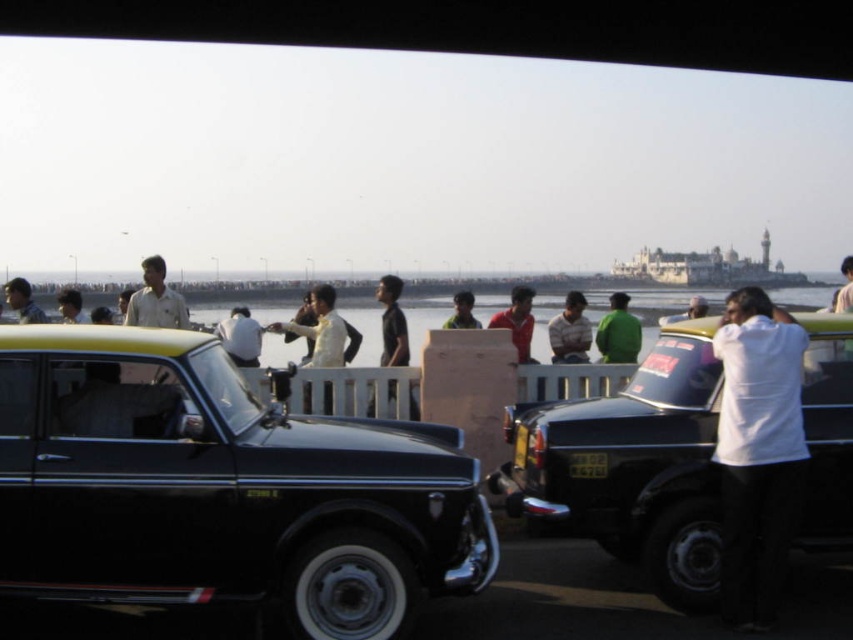
Consider the image. How distant is white matte shirt at right from green matte shirt at center?

white matte shirt at right is 71.08 feet away from green matte shirt at center.

This screenshot has width=853, height=640. I want to click on white matte shirt at right, so click(757, 451).

Between point (798, 461) and point (613, 332), which one is positioned behind?

Positioned behind is point (613, 332).

Where is `white matte shirt at right`? This screenshot has height=640, width=853. white matte shirt at right is located at coordinates (757, 451).

Can you confirm if light brown fabric shirt at center is wider than light brown skin at center?

No.

Who is positioned more to the right, light brown fabric shirt at center or light brown skin at center?

light brown fabric shirt at center is more to the right.

Which is behind, point (579, 304) or point (64, 317)?

The point (64, 317) is more distant.

Where is `light brown fabric shirt at center`? light brown fabric shirt at center is located at coordinates (570, 332).

Who is shorter, black matte shirt at center or light brown skin at center?

Standing shorter between the two is light brown skin at center.

Which is behind, point (398, 323) or point (88, 323)?

Positioned behind is point (88, 323).

Which is behind, point (392, 312) or point (86, 321)?

Point (86, 321)

Image resolution: width=853 pixels, height=640 pixels. In order to click on black matte shirt at center in this screenshot , I will do `click(392, 323)`.